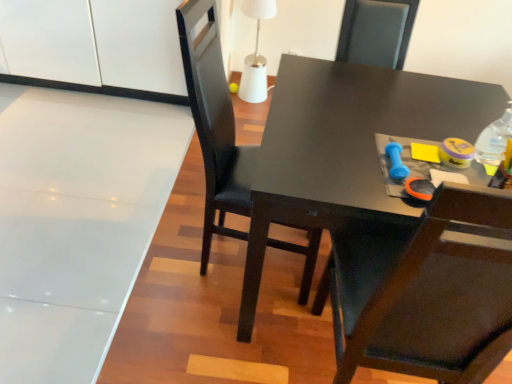
Locate an element on the screen. This screenshot has height=384, width=512. free space to the left of blue rubber dumbbell at upper right is located at coordinates (338, 160).